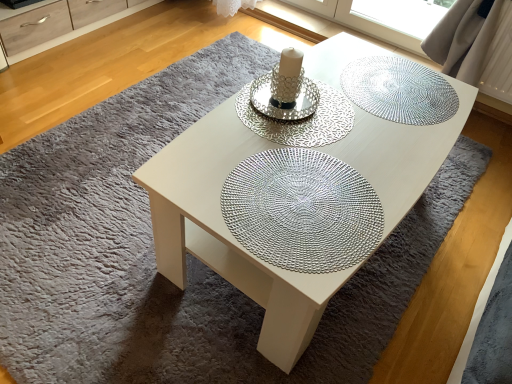
At what (x,y) coordinates should I click in order to perform the action: click on silver metallic doily at center, the second glass plate when ordered from front to back. Please return your answer as a coordinate pair (x, y). The height and width of the screenshot is (384, 512). Looking at the image, I should click on [300, 120].

Describe the element at coordinates (300, 120) in the screenshot. I see `silver metallic doily at center, the 2th glass plate in the back-to-front sequence` at that location.

Where is `white glossy coffee table at center`? The image size is (512, 384). white glossy coffee table at center is located at coordinates (216, 186).

The width and height of the screenshot is (512, 384). I want to click on silver textured doily at center, the first glass plate in the front-to-back sequence, so click(302, 211).

Based on the photo, is metallic silver doily at upper right, which ranks as the first glass plate in back-to-front order, turned away from white glossy coffee table at center?

Absolutely, metallic silver doily at upper right, which ranks as the first glass plate in back-to-front order, is directed away from white glossy coffee table at center.

Is point (430, 90) less distant than point (406, 162)?

No, it is not.

Which is more to the left, metallic silver doily at upper right, which ranks as the first glass plate in back-to-front order, or white glossy coffee table at center?

white glossy coffee table at center.

Consider the image. From a real-world perspective, is metallic silver doily at upper right, which ranks as the first glass plate in back-to-front order, under white glossy coffee table at center?

Actually, metallic silver doily at upper right, which ranks as the first glass plate in back-to-front order, is physically above white glossy coffee table at center in the real world.

Identify the location of coffee table located in front of the matte wood dresser at upper left. This screenshot has height=384, width=512. (216, 186).

Consider the image. Is white glossy coffee table at center not near matte wood dresser at upper left?

white glossy coffee table at center is positioned a significant distance from matte wood dresser at upper left.

From the image's perspective, who appears lower, white glossy coffee table at center or matte wood dresser at upper left?

white glossy coffee table at center appears lower in the image.

Can we say white glossy coffee table at center lies outside matte wood dresser at upper left?

Yes.

In terms of size, does metallic silver doily at upper right, which ranks as the first glass plate in back-to-front order, appear bigger or smaller than silver textured doily at center, positioned as the 3th glass plate in back-to-front order?

metallic silver doily at upper right, which ranks as the first glass plate in back-to-front order, is bigger than silver textured doily at center, positioned as the 3th glass plate in back-to-front order.

In the scene shown: Would you consider metallic silver doily at upper right, which ranks as the first glass plate in back-to-front order, to be distant from silver textured doily at center, positioned as the 3th glass plate in back-to-front order?

Actually, metallic silver doily at upper right, which ranks as the first glass plate in back-to-front order, and silver textured doily at center, positioned as the 3th glass plate in back-to-front order, are a little close together.

Which glass plate is the 2nd one when counting from the back of the silver textured doily at center, positioned as the 3th glass plate in back-to-front order? Please provide its 2D coordinates.

[(399, 90)]

How much distance is there between metallic silver doily at upper right, which ranks as the first glass plate in back-to-front order, and silver textured doily at center, the first glass plate in the front-to-back sequence?

metallic silver doily at upper right, which ranks as the first glass plate in back-to-front order, and silver textured doily at center, the first glass plate in the front-to-back sequence, are 19.63 inches apart.

How different are the orientations of matte wood dresser at upper left and silver textured doily at center, the first glass plate in the front-to-back sequence, in degrees?

The angular difference between matte wood dresser at upper left and silver textured doily at center, the first glass plate in the front-to-back sequence, is 178 degrees.

At what (x,y) coordinates should I click in order to perform the action: click on dresser that appears below the silver textured doily at center, positioned as the 3th glass plate in back-to-front order (from a real-world perspective). Please return your answer as a coordinate pair (x, y). Image resolution: width=512 pixels, height=384 pixels. Looking at the image, I should click on (79, 32).

Considering the sizes of objects matte wood dresser at upper left and silver textured doily at center, the first glass plate in the front-to-back sequence, in the image provided, who is shorter, matte wood dresser at upper left or silver textured doily at center, the first glass plate in the front-to-back sequence,?

Standing shorter between the two is silver textured doily at center, the first glass plate in the front-to-back sequence.

Does point (322, 174) lie behind point (57, 44)?

That is False.

Could you tell me if silver textured doily at center, positioned as the 3th glass plate in back-to-front order, is facing matte wood dresser at upper left?

No, silver textured doily at center, positioned as the 3th glass plate in back-to-front order, is not facing towards matte wood dresser at upper left.

From their relative heights in the image, would you say silver textured doily at center, positioned as the 3th glass plate in back-to-front order, is taller or shorter than matte wood dresser at upper left?

Considering their sizes, silver textured doily at center, positioned as the 3th glass plate in back-to-front order, has less height than matte wood dresser at upper left.

Is silver textured doily at center, the first glass plate in the front-to-back sequence, at the left side of matte wood dresser at upper left?

No, silver textured doily at center, the first glass plate in the front-to-back sequence, is not to the left of matte wood dresser at upper left.

Is silver textured doily at center, the first glass plate in the front-to-back sequence, shorter than silver metallic doily at center, the second glass plate when ordered from front to back?

Yes.

Considering the relative sizes of silver textured doily at center, positioned as the 3th glass plate in back-to-front order, and silver metallic doily at center, the second glass plate when ordered from front to back, in the image provided, is silver textured doily at center, positioned as the 3th glass plate in back-to-front order, smaller than silver metallic doily at center, the second glass plate when ordered from front to back,?

Incorrect, silver textured doily at center, positioned as the 3th glass plate in back-to-front order, is not smaller in size than silver metallic doily at center, the second glass plate when ordered from front to back.

Where is `the 1st glass plate positioned above the silver textured doily at center, positioned as the 3th glass plate in back-to-front order (from the image's perspective)`? the 1st glass plate positioned above the silver textured doily at center, positioned as the 3th glass plate in back-to-front order (from the image's perspective) is located at coordinates (300, 120).

Is point (362, 239) closer or farther from the camera than point (272, 123)?

Point (362, 239) is closer to the camera than point (272, 123).

From the picture: How many degrees apart are the facing directions of silver metallic doily at center, the second glass plate when ordered from front to back, and matte wood dresser at upper left?

There is a 178-degree angle between the facing directions of silver metallic doily at center, the second glass plate when ordered from front to back, and matte wood dresser at upper left.

In the image, there is a silver metallic doily at center, the 2th glass plate in the back-to-front sequence. Where is `dresser below it (from a real-world perspective)`? dresser below it (from a real-world perspective) is located at coordinates (79, 32).

From the image's perspective, which is below, silver metallic doily at center, the 2th glass plate in the back-to-front sequence, or matte wood dresser at upper left?

silver metallic doily at center, the 2th glass plate in the back-to-front sequence, from the image's perspective.

Is silver metallic doily at center, the second glass plate when ordered from front to back, oriented towards matte wood dresser at upper left?

No, silver metallic doily at center, the second glass plate when ordered from front to back, is not turned towards matte wood dresser at upper left.

In order to click on coffee table below the metallic silver doily at upper right, which ranks as the first glass plate in back-to-front order (from the image's perspective) in this screenshot , I will do `click(216, 186)`.

Identify the location of coffee table on the right of matte wood dresser at upper left. (216, 186).

When comparing their distances from white glossy coffee table at center, does silver textured doily at center, positioned as the 3th glass plate in back-to-front order, or silver metallic doily at center, the second glass plate when ordered from front to back, seem further?

silver metallic doily at center, the second glass plate when ordered from front to back, lies further to white glossy coffee table at center than the other object.

Considering their positions, is white glossy coffee table at center positioned closer to matte wood dresser at upper left than silver metallic doily at center, the 2th glass plate in the back-to-front sequence?

silver metallic doily at center, the 2th glass plate in the back-to-front sequence, lies closer to matte wood dresser at upper left than the other object.

When comparing their distances from silver metallic doily at center, the 2th glass plate in the back-to-front sequence, does matte wood dresser at upper left or silver textured doily at center, positioned as the 3th glass plate in back-to-front order, seem closer?

The object closer to silver metallic doily at center, the 2th glass plate in the back-to-front sequence, is silver textured doily at center, positioned as the 3th glass plate in back-to-front order.

Which object lies nearer to the anchor point metallic silver doily at upper right, positioned as the third glass plate in front-to-back order, silver textured doily at center, positioned as the 3th glass plate in back-to-front order, or silver metallic doily at center, the second glass plate when ordered from front to back?

silver metallic doily at center, the second glass plate when ordered from front to back.

Considering their positions, is silver metallic doily at center, the second glass plate when ordered from front to back, positioned further to white glossy coffee table at center than metallic silver doily at upper right, positioned as the third glass plate in front-to-back order?

metallic silver doily at upper right, positioned as the third glass plate in front-to-back order, lies further to white glossy coffee table at center than the other object.

When comparing their distances from white glossy coffee table at center, does metallic silver doily at upper right, which ranks as the first glass plate in back-to-front order, or silver metallic doily at center, the 2th glass plate in the back-to-front sequence, seem closer?

silver metallic doily at center, the 2th glass plate in the back-to-front sequence, lies closer to white glossy coffee table at center than the other object.

From the image, which object appears to be nearer to metallic silver doily at upper right, which ranks as the first glass plate in back-to-front order, white glossy coffee table at center or matte wood dresser at upper left?

Among the two, white glossy coffee table at center is located nearer to metallic silver doily at upper right, which ranks as the first glass plate in back-to-front order.

From the image, which object appears to be farther from matte wood dresser at upper left, silver textured doily at center, positioned as the 3th glass plate in back-to-front order, or metallic silver doily at upper right, which ranks as the first glass plate in back-to-front order?

Based on the image, silver textured doily at center, positioned as the 3th glass plate in back-to-front order, appears to be further to matte wood dresser at upper left.

Identify the location of glass plate situated between matte wood dresser at upper left and silver metallic doily at center, the second glass plate when ordered from front to back, from left to right. (302, 211).

Image resolution: width=512 pixels, height=384 pixels. I want to click on glass plate between silver textured doily at center, positioned as the 3th glass plate in back-to-front order, and metallic silver doily at upper right, which ranks as the first glass plate in back-to-front order, in the horizontal direction, so click(300, 120).

Locate an element on the screen. This screenshot has width=512, height=384. glass plate positioned between white glossy coffee table at center and silver metallic doily at center, the 2th glass plate in the back-to-front sequence, from near to far is located at coordinates (302, 211).

The height and width of the screenshot is (384, 512). Find the location of `coffee table located between matte wood dresser at upper left and metallic silver doily at upper right, positioned as the third glass plate in front-to-back order, in the left-right direction`. coffee table located between matte wood dresser at upper left and metallic silver doily at upper right, positioned as the third glass plate in front-to-back order, in the left-right direction is located at coordinates (216, 186).